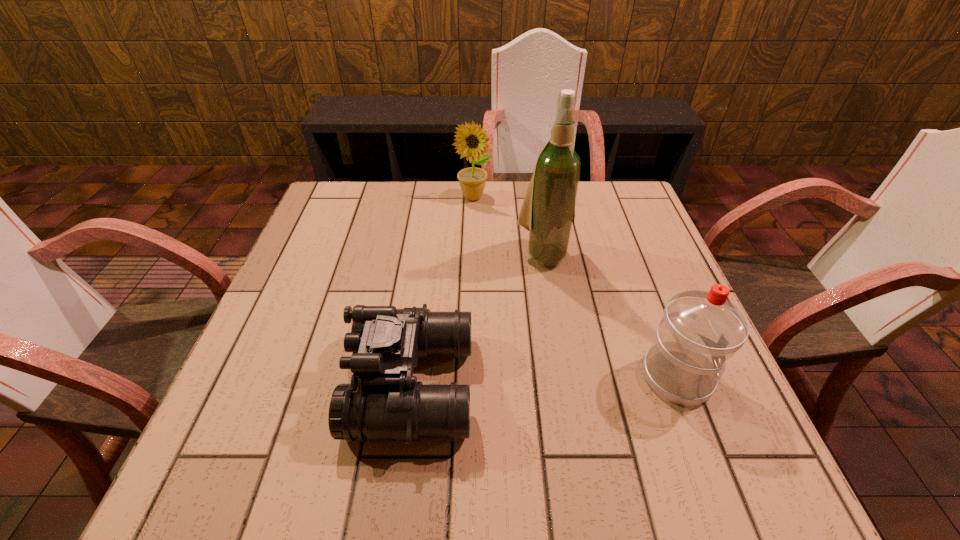
This screenshot has width=960, height=540. Find the location of `free space located 0.370m on the face of the sunflower`. free space located 0.370m on the face of the sunflower is located at coordinates (529, 291).

Where is `vacant space located 0.110m on the front-facing side of the third nearest object`? The image size is (960, 540). vacant space located 0.110m on the front-facing side of the third nearest object is located at coordinates (559, 305).

In order to click on free space located on the front-facing side of the third nearest object in this screenshot , I will do `click(564, 322)`.

Where is `free space located on the front-facing side of the third nearest object`? free space located on the front-facing side of the third nearest object is located at coordinates (590, 410).

Where is `object located in the far edge section of the desktop`? The width and height of the screenshot is (960, 540). object located in the far edge section of the desktop is located at coordinates (471, 140).

Where is `binoculars positioned at the near edge`? binoculars positioned at the near edge is located at coordinates (384, 402).

The image size is (960, 540). What are the coordinates of `water bottle situated at the near edge` in the screenshot? It's located at (700, 330).

Image resolution: width=960 pixels, height=540 pixels. I want to click on object present at the right edge, so click(700, 330).

Locate an element on the screen. object situated at the near right corner is located at coordinates (700, 330).

You are a GUI agent. You are given a task and a screenshot of the screen. Output one action in this format:
    pyautogui.click(x=<x>, y=<y>)
    Task: Click on the vacant space at the far edge of the desktop
    The image size is (960, 540).
    Given the screenshot: What is the action you would take?
    pyautogui.click(x=513, y=203)